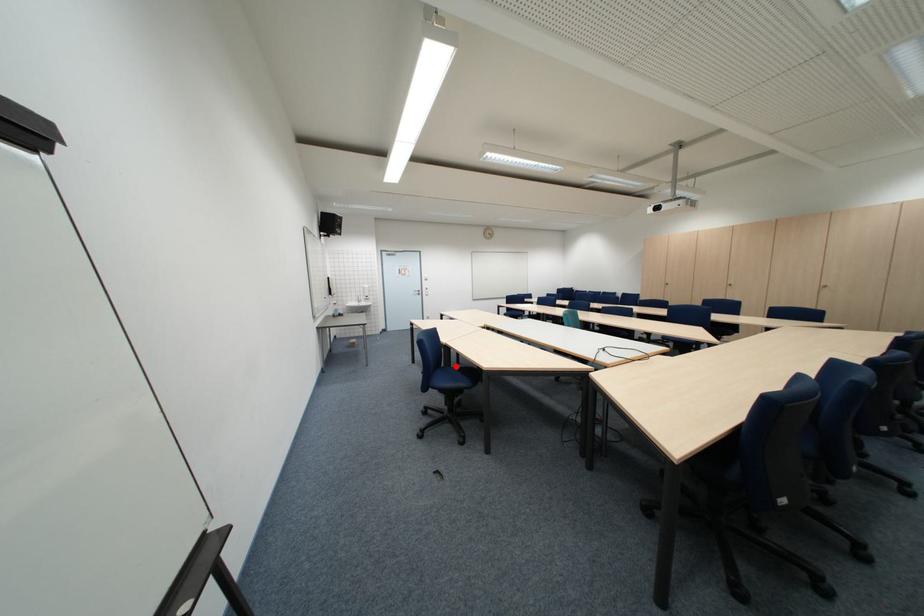
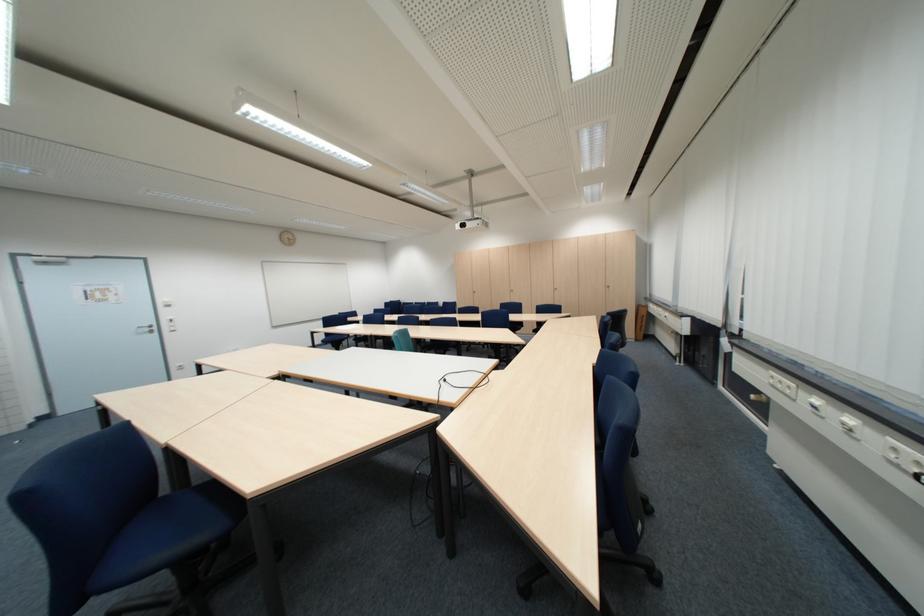
Question: I am providing you with two images of the same scene from different viewpoints. A red point is marked on the first image. At the location where the point appears in image 1, is it still visible in image 2?

Choices:
 (A) Yes
 (B) No

Answer: (A)